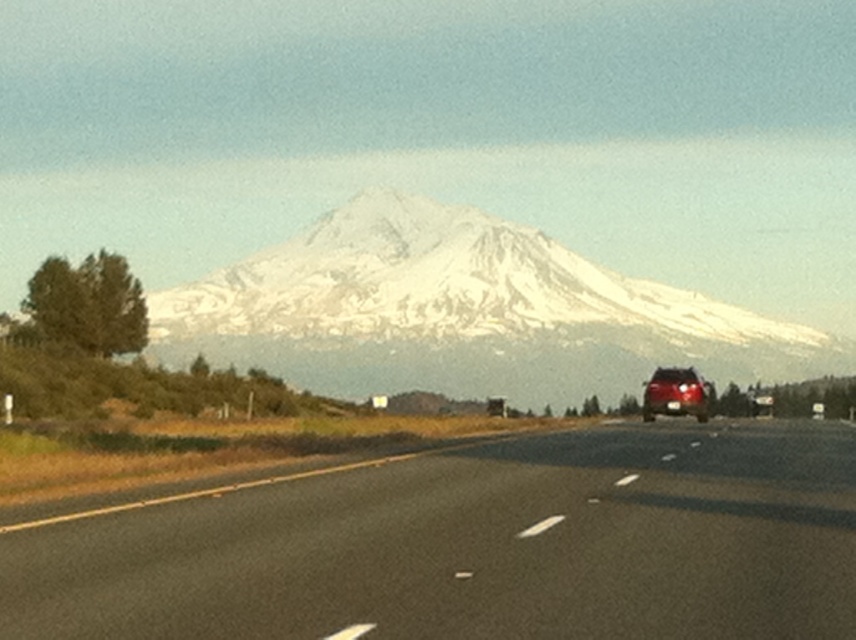
How distant is black asphalt road at center from satin red suv at center?

A distance of 24.80 meters exists between black asphalt road at center and satin red suv at center.

Between black asphalt road at center and satin red suv at center, which one is positioned higher?

satin red suv at center is higher up.

Is point (545, 442) less distant than point (705, 397)?

That is True.

Locate an element on the screen. The image size is (856, 640). black asphalt road at center is located at coordinates (477, 547).